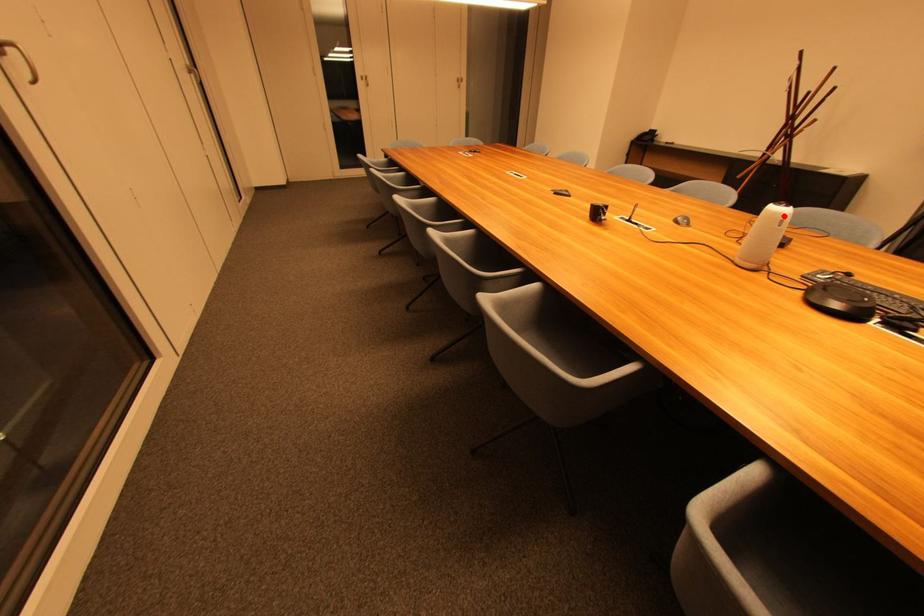
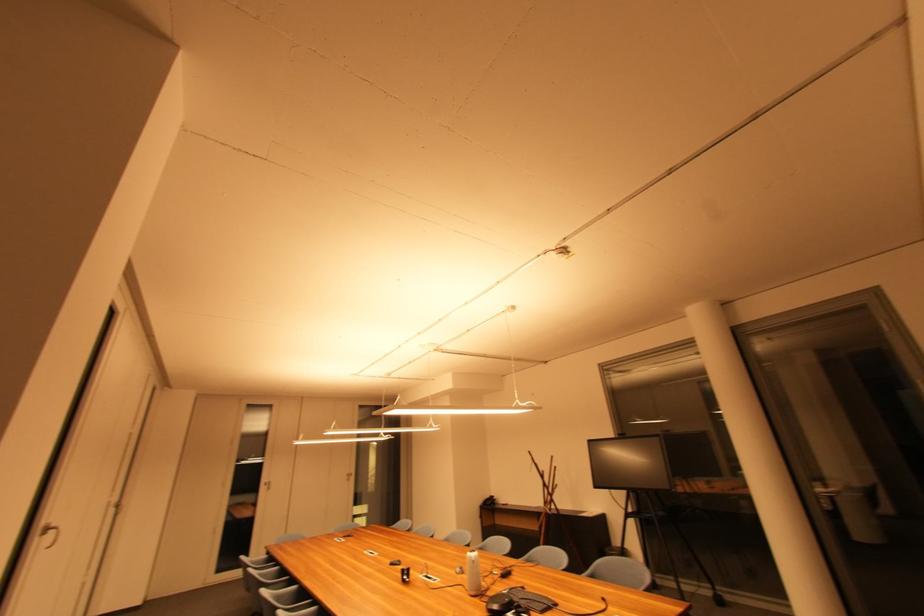
Where in the second image is the point corresponding to the highlighted location from the first image?

(477, 560)